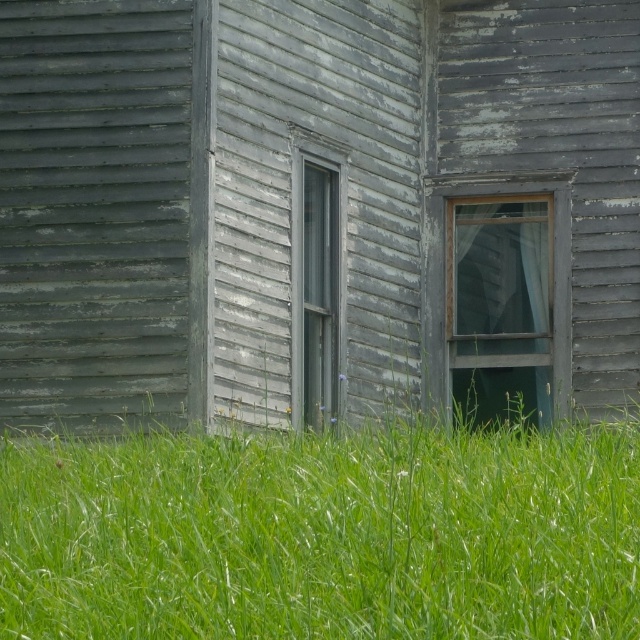
Which is behind, point (228, 346) or point (332, 336)?

The point (332, 336) is more distant.

This screenshot has width=640, height=640. I want to click on weathered gray wood at center, so click(x=316, y=211).

You are a GUI agent. You are given a task and a screenshot of the screen. Output one action in this format:
    pyautogui.click(x=<x>, y=<y>)
    Task: Click on the weathered gray wood at center
    The width and height of the screenshot is (640, 640).
    Given the screenshot: What is the action you would take?
    pyautogui.click(x=316, y=211)

Which is more to the right, weathered gray wood at center or transparent glass window at right?

Positioned to the right is transparent glass window at right.

Can you confirm if weathered gray wood at center is bigger than transparent glass window at right?

Incorrect, weathered gray wood at center is not larger than transparent glass window at right.

Is point (83, 28) closer to camera compared to point (483, 280)?

Yes, point (83, 28) is closer to viewer.

Find the location of a particular element. The image size is (640, 640). weathered gray wood at center is located at coordinates (316, 211).

Is transparent glass window at right smaller than gray wooden window at center?

No.

Which is behind, point (550, 208) or point (298, 349)?

The point (550, 208) is behind.

The height and width of the screenshot is (640, 640). What do you see at coordinates (500, 298) in the screenshot?
I see `transparent glass window at right` at bounding box center [500, 298].

Locate an element on the screen. transparent glass window at right is located at coordinates (500, 298).